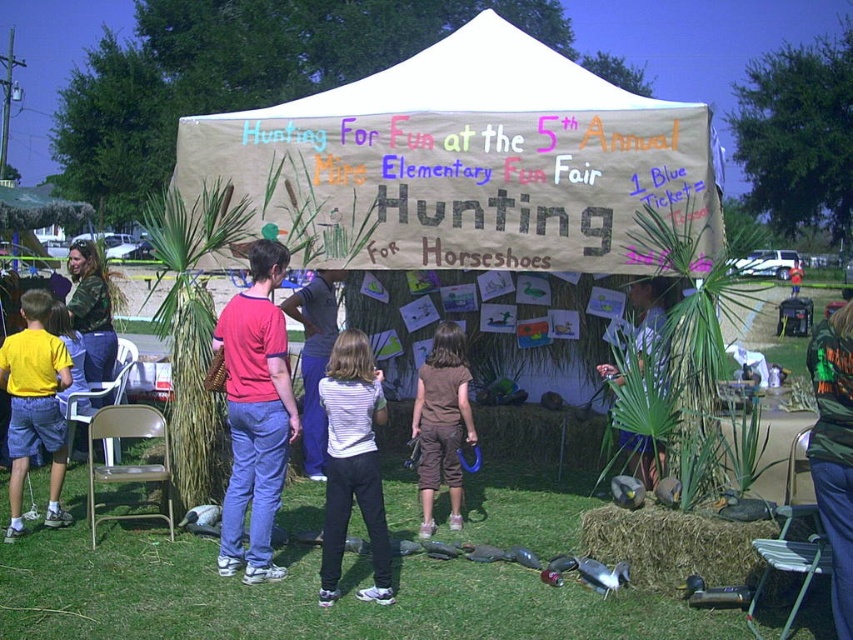
Question: Which object appears closest to the camera in this image?

Choices:
 (A) camouflage jacket at center
 (B) red shirt at center
 (C) brown cotton shorts at center
 (D) red woven bag at center

Answer: (D)

Question: In this image, where is red woven bag at center located relative to camouflage jacket at center?

Choices:
 (A) below
 (B) above

Answer: (A)

Question: Which of the following is the farthest from the observer?

Choices:
 (A) (115, 353)
 (B) (225, 344)

Answer: (A)

Question: Is red woven bag at center positioned before yellow matte shirt at center?

Choices:
 (A) no
 (B) yes

Answer: (B)

Question: Which point is closer to the camera taking this photo?

Choices:
 (A) (349, 452)
 (B) (660, 284)

Answer: (A)

Question: Is brown cotton shorts at center above camouflage jacket at center?

Choices:
 (A) yes
 (B) no

Answer: (B)